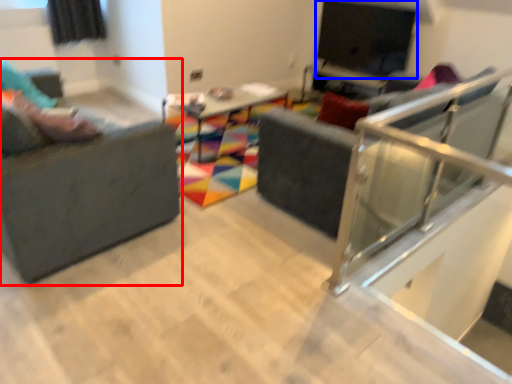
Question: Which point is further to the camera, studio couch (highlighted by a red box) or window screen (highlighted by a blue box)?

Choices:
 (A) studio couch
 (B) window screen

Answer: (B)